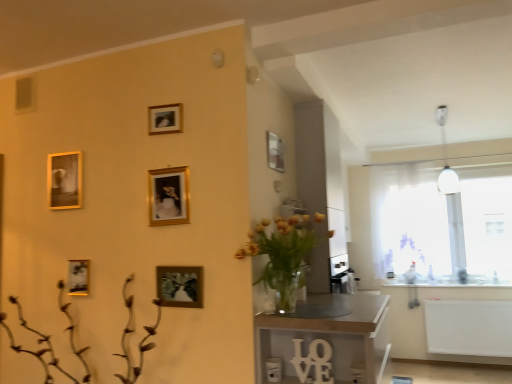
Question: Considering the relative sizes of gold metallic picture frame at center, the first picture frame ordered from the bottom, and gold metallic picture frame at center, which is counted as the 2th picture frame, starting from the right, in the image provided, is gold metallic picture frame at center, the first picture frame ordered from the bottom, smaller than gold metallic picture frame at center, which is counted as the 2th picture frame, starting from the right,?

Choices:
 (A) no
 (B) yes

Answer: (A)

Question: Is gold metallic picture frame at center, which ranks as the first picture frame in right-to-left order, surrounding gold metallic picture frame at center, arranged as the third picture frame when viewed from the top?

Choices:
 (A) no
 (B) yes

Answer: (A)

Question: Is gold metallic picture frame at center, marked as the fourth picture frame in a left-to-right arrangement, at the back of gold metallic picture frame at center, which is the 5th picture frame in left-to-right order?

Choices:
 (A) yes
 (B) no

Answer: (B)

Question: Is gold metallic picture frame at center, which is the 5th picture frame in left-to-right order, aimed at gold metallic picture frame at center, marked as the fourth picture frame in a left-to-right arrangement?

Choices:
 (A) yes
 (B) no

Answer: (B)

Question: Is gold metallic picture frame at center, marked as the fifth picture frame in a top-to-bottom arrangement, shorter than gold metallic picture frame at center, marked as the fourth picture frame in a left-to-right arrangement?

Choices:
 (A) yes
 (B) no

Answer: (A)

Question: Is gold metallic picture frame at center, marked as the fifth picture frame in a top-to-bottom arrangement, not within gold metallic picture frame at center, arranged as the third picture frame when viewed from the top?

Choices:
 (A) yes
 (B) no

Answer: (A)

Question: Does translucent glass vase at center have a greater width compared to transparent glass window at right?

Choices:
 (A) yes
 (B) no

Answer: (A)

Question: Could you tell me if translucent glass vase at center is facing transparent glass window at right?

Choices:
 (A) no
 (B) yes

Answer: (A)

Question: Is translucent glass vase at center not close to transparent glass window at right?

Choices:
 (A) no
 (B) yes

Answer: (B)

Question: From a real-world perspective, does translucent glass vase at center stand above transparent glass window at right?

Choices:
 (A) no
 (B) yes

Answer: (A)

Question: Considering the relative sizes of translucent glass vase at center and transparent glass window at right in the image provided, is translucent glass vase at center bigger than transparent glass window at right?

Choices:
 (A) no
 (B) yes

Answer: (A)

Question: Is translucent glass vase at center next to transparent glass window at right and touching it?

Choices:
 (A) yes
 (B) no

Answer: (B)

Question: Is white sheer curtain at right looking in the opposite direction of wooden table at center?

Choices:
 (A) yes
 (B) no

Answer: (B)